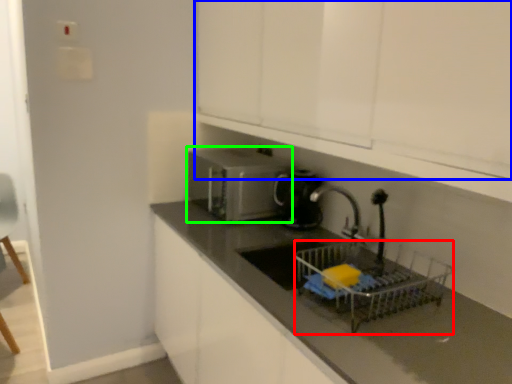
Question: Based on their relative distances, which object is farther from basket (highlighted by a red box)? Choose from cabinetry (highlighted by a blue box) and home appliance (highlighted by a green box).

Choices:
 (A) cabinetry
 (B) home appliance

Answer: (B)